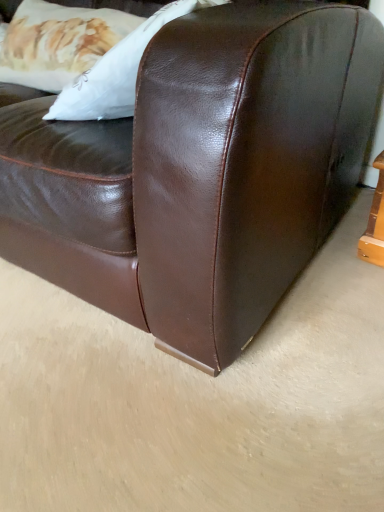
Question: Should I look upward or downward to see white soft pillow at upper left?

Choices:
 (A) up
 (B) down

Answer: (A)